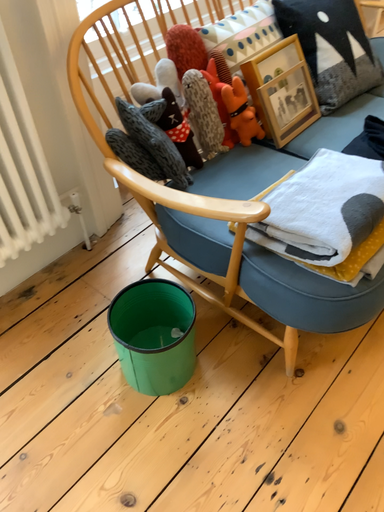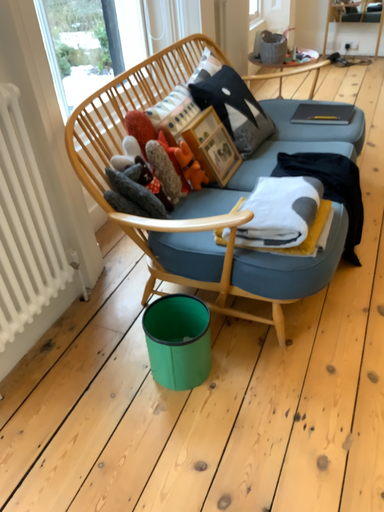
Question: Which way did the camera rotate in the video?

Choices:
 (A) rotated downward
 (B) rotated upward

Answer: (B)